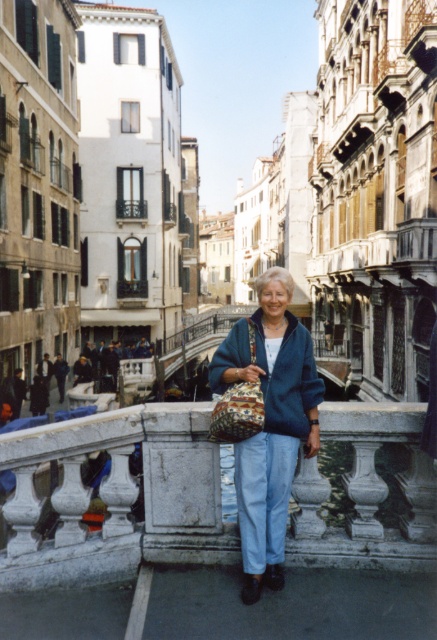
You are a tourist standing on the bridge in Venice. You see a white marble railing at center and a blue woolen cardigan at center. Which object is positioned to the left when facing the canal?

The white marble railing at center is to the left of the blue woolen cardigan at center.

You are a tourist standing on the bridge in Venice and want to take a photo of the canal. To ensure the white marble railing at center is in the frame, where should you position yourself relative to the railing?

The white marble railing at center is located at the center of the bridge, so positioning yourself near the center of the bridge will ensure the railing is in the frame.

You are a tourist standing on the bridge in Venice. You want to take a photo of the canal while holding your denim jacket at center. To avoid the white marble railing at center blocking your shot, should you move your jacket to the right or left?

The white marble railing at center is to the left of the denim jacket at center. To avoid the railing blocking the shot, you should move your denim jacket at center to the right.